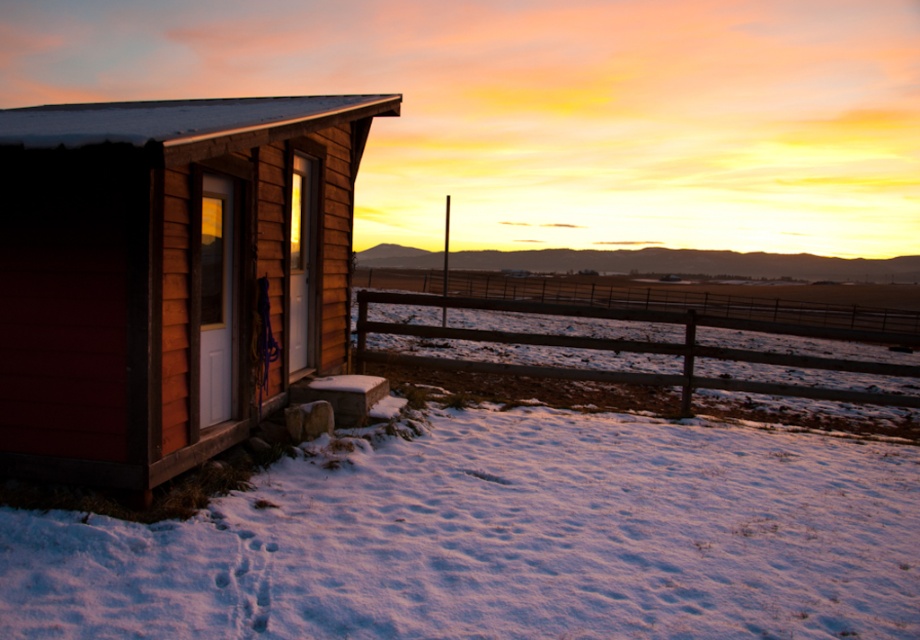
You are standing in the winter scene and want to walk from the wooden cabin at left to the brown wooden fence at lower center. Which direction should you head towards?

You should head towards the right direction from the wooden cabin at left to reach the brown wooden fence at lower center since the wooden cabin at left is positioned on the left side of the brown wooden fence at lower center.

You are an architect designing a winter scene and want to ensure the wooden cabin at left and the brown wooden fence at lower center are proportionally accurate. Based on the image, which object should be drawn smaller in your design?

The wooden cabin at left should be drawn smaller than the brown wooden fence at lower center because the description states that the wooden cabin at left is smaller than the brown wooden fence at lower center.